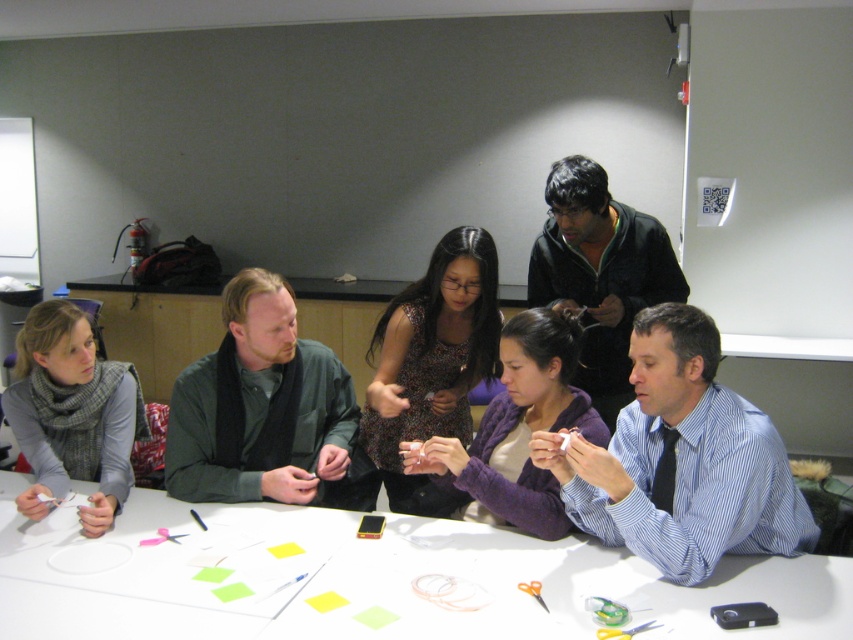
Can you confirm if gray wool scarf at left is shorter than purple fleece sweater at center?

In fact, gray wool scarf at left may be taller than purple fleece sweater at center.

What do you see at coordinates (73, 413) in the screenshot? The width and height of the screenshot is (853, 640). I see `gray wool scarf at left` at bounding box center [73, 413].

Image resolution: width=853 pixels, height=640 pixels. What do you see at coordinates (73, 413) in the screenshot?
I see `gray wool scarf at left` at bounding box center [73, 413].

This screenshot has width=853, height=640. Identify the location of gray wool scarf at left. (73, 413).

Can you confirm if blue striped shirt at center is smaller than purple fleece sweater at center?

No, blue striped shirt at center is not smaller than purple fleece sweater at center.

Is blue striped shirt at center above purple fleece sweater at center?

No.

Who is more distant from viewer, (809, 522) or (503, 342)?

The point (503, 342) is behind.

Identify the location of blue striped shirt at center. (682, 460).

Between point (413, 476) and point (663, 298), which one is positioned in front?

Point (413, 476)

Who is more distant from viewer, [451,492] or [592,248]?

The point [592,248] is behind.

The width and height of the screenshot is (853, 640). What are the coordinates of `patterned fabric dress at center` in the screenshot? It's located at (432, 364).

I want to click on patterned fabric dress at center, so click(x=432, y=364).